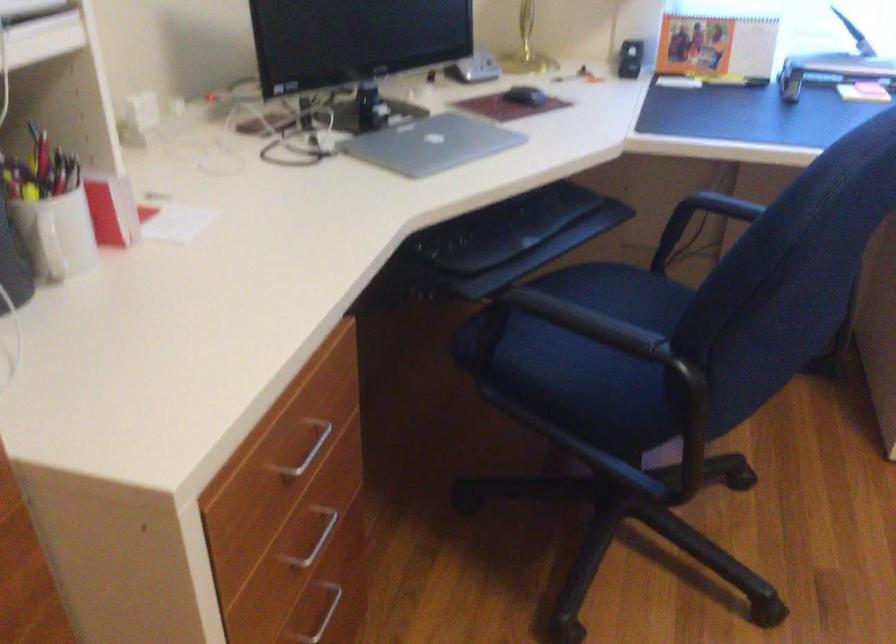
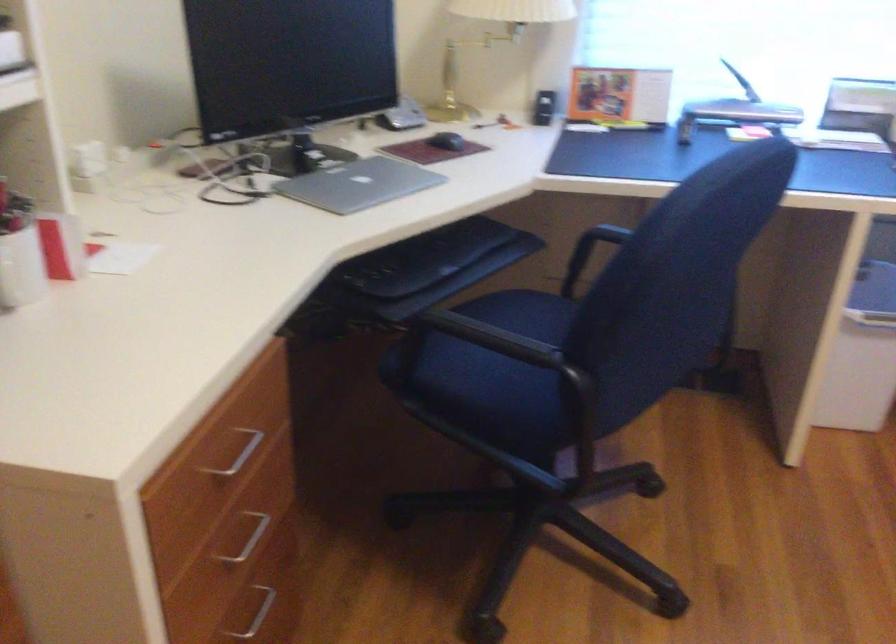
In the second image, find the point that corresponds to the point at 567,322 in the first image.

(478, 339)